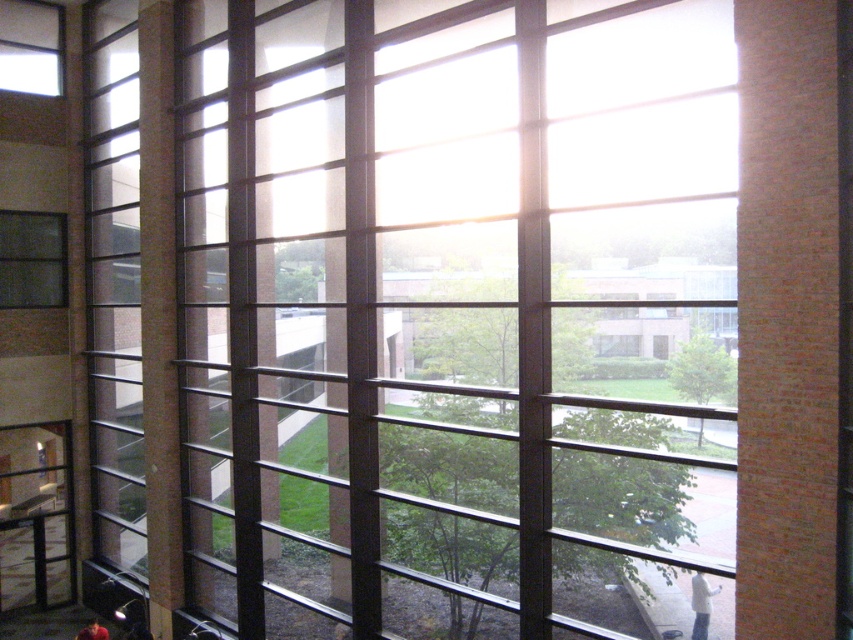
Is transparent glass window at center smaller than matte glass window at left?

Incorrect, transparent glass window at center is not smaller in size than matte glass window at left.

The width and height of the screenshot is (853, 640). Find the location of `transparent glass window at center`. transparent glass window at center is located at coordinates (457, 314).